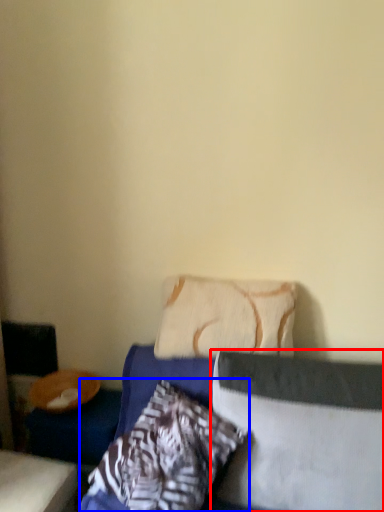
Question: Which object is further to the camera taking this photo, pillow (highlighted by a red box) or pillow (highlighted by a blue box)?

Choices:
 (A) pillow
 (B) pillow

Answer: (A)